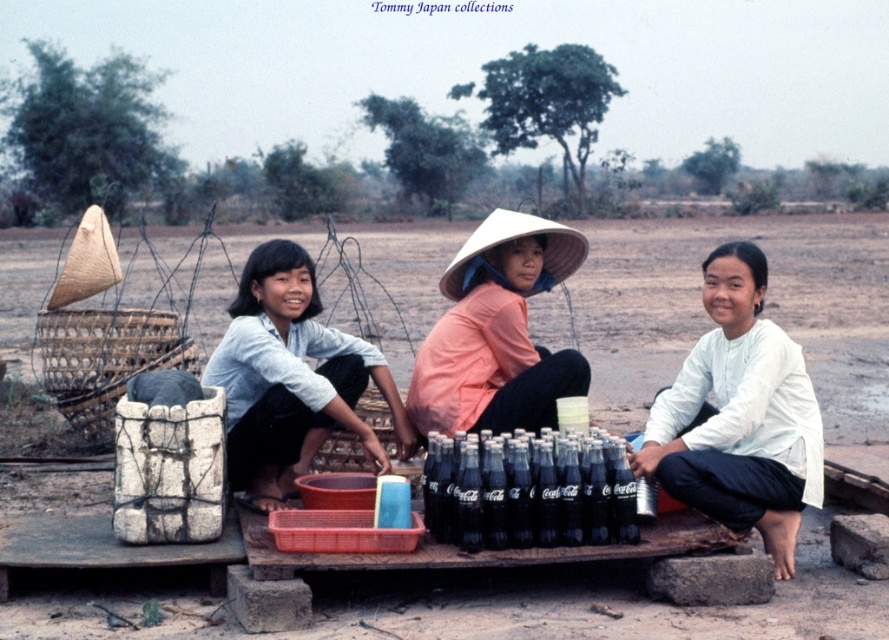
Question: Which object appears closest to the camera in this image?

Choices:
 (A) black glass bottles at center
 (B) white cotton shirt at center

Answer: (A)

Question: Which of the following is the closest to the observer?

Choices:
 (A) pink fabric hat at center
 (B) light blue cotton shirt at center

Answer: (B)

Question: Is light blue cotton shirt at center closer to the viewer compared to pink fabric hat at center?

Choices:
 (A) no
 (B) yes

Answer: (B)

Question: Is white cotton shirt at center further to the viewer compared to black glass bottles at center?

Choices:
 (A) yes
 (B) no

Answer: (A)

Question: Is light blue cotton shirt at center behind black glass bottles at center?

Choices:
 (A) no
 (B) yes

Answer: (B)

Question: Which of the following is the closest to the observer?

Choices:
 (A) (275, 376)
 (B) (785, 483)

Answer: (B)